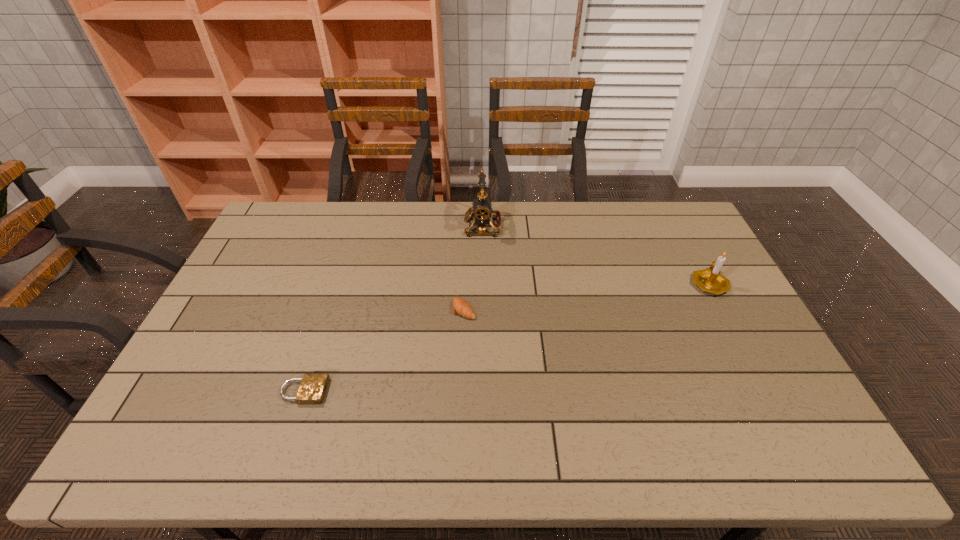
I want to click on the farthest object, so click(481, 212).

At what (x,y) coordinates should I click in order to perform the action: click on telephone. Please return your answer as a coordinate pair (x, y). The width and height of the screenshot is (960, 540). Looking at the image, I should click on (481, 212).

Where is `the second farthest object`? the second farthest object is located at coordinates (710, 280).

Where is `the rightmost object`? the rightmost object is located at coordinates (710, 280).

Where is `the second nearest object`? the second nearest object is located at coordinates (461, 307).

Where is `the second shortest object`? This screenshot has height=540, width=960. the second shortest object is located at coordinates (461, 307).

Find the location of a particular element. the shortest object is located at coordinates point(312,389).

I want to click on the leftmost object, so click(312, 389).

You are a GUI agent. You are given a task and a screenshot of the screen. Output one action in this format:
    pyautogui.click(x=<x>, y=<y>)
    Task: Click on the free region located 0.130m on the front of the farthest object, featuring the rotary dial
    The height and width of the screenshot is (540, 960).
    Given the screenshot: What is the action you would take?
    pyautogui.click(x=429, y=226)

Where is `vacant area located 0.190m on the front of the farthest object, featuring the rotary dial`? This screenshot has height=540, width=960. vacant area located 0.190m on the front of the farthest object, featuring the rotary dial is located at coordinates (413, 226).